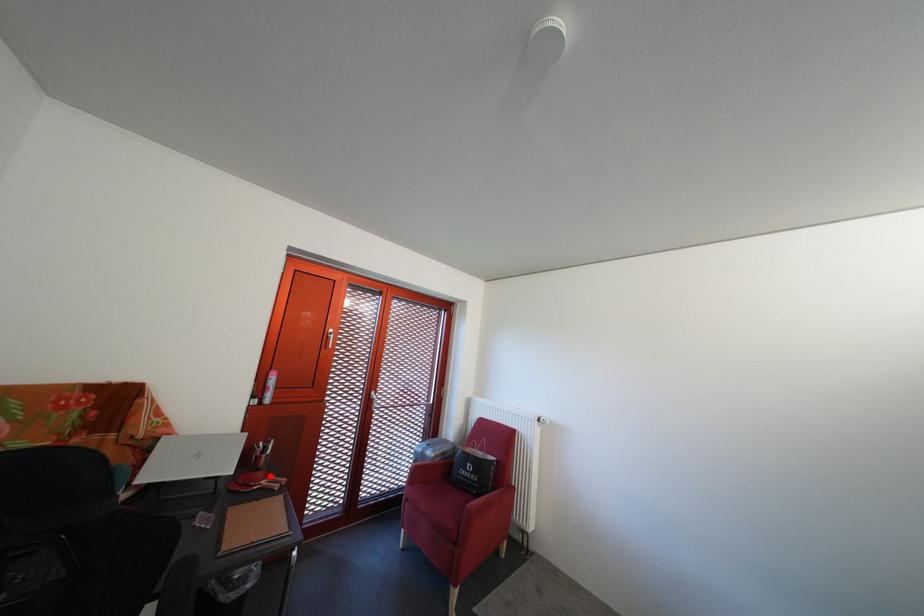
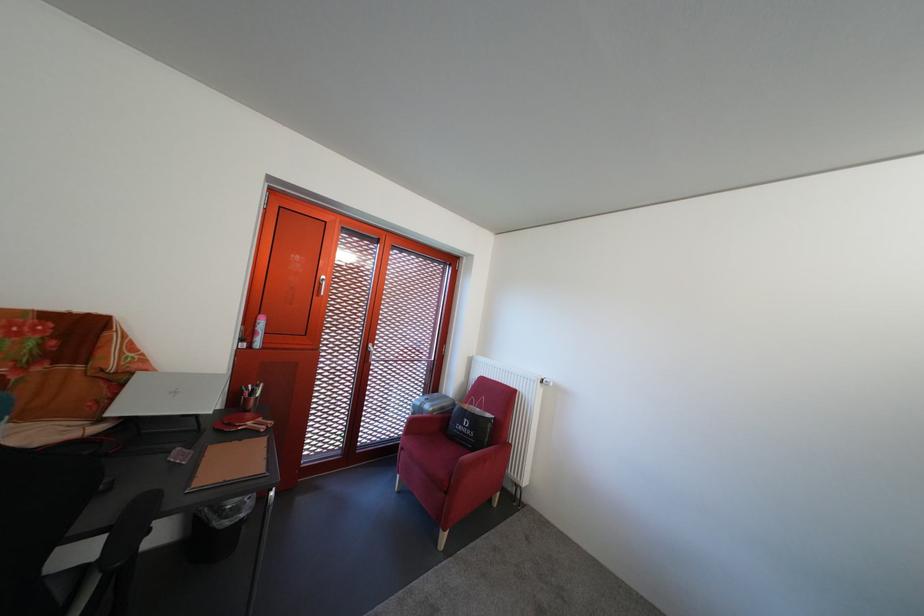
In the second image, find the point that corresponds to the highlighted location in the first image.

(260, 418)